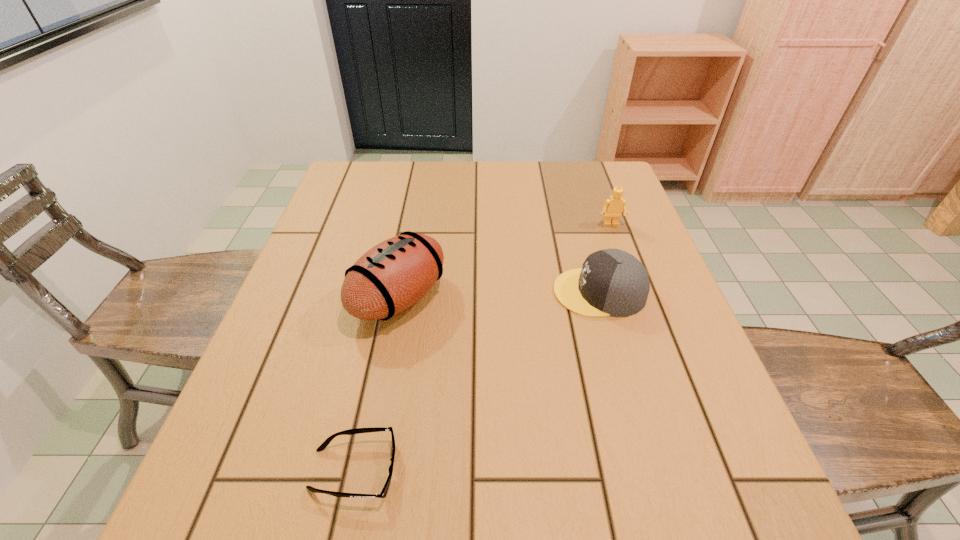
Locate an element on the screen. free space located on the front-facing side of the second shortest object is located at coordinates (493, 292).

You are a GUI agent. You are given a task and a screenshot of the screen. Output one action in this format:
    pyautogui.click(x=<x>, y=<y>)
    Task: Click on the vacant space located on the front-facing side of the sunglasses
    
    Given the screenshot: What is the action you would take?
    pyautogui.click(x=617, y=469)

What are the coordinates of `object that is at the near edge` in the screenshot? It's located at (383, 493).

Locate an element on the screen. This screenshot has width=960, height=540. object that is at the left edge is located at coordinates (395, 274).

The height and width of the screenshot is (540, 960). I want to click on Lego positioned at the right edge, so click(613, 207).

The image size is (960, 540). What are the coordinates of `cap that is at the right edge` in the screenshot? It's located at (611, 282).

Locate an element on the screen. free space at the far edge of the desktop is located at coordinates (546, 175).

In the image, there is a desktop. Where is `vacant space at the near edge`? vacant space at the near edge is located at coordinates (587, 510).

What are the coordinates of `vacant space at the left edge of the desktop` in the screenshot? It's located at (324, 208).

Find the location of `free space at the right edge of the desktop`. free space at the right edge of the desktop is located at coordinates (671, 334).